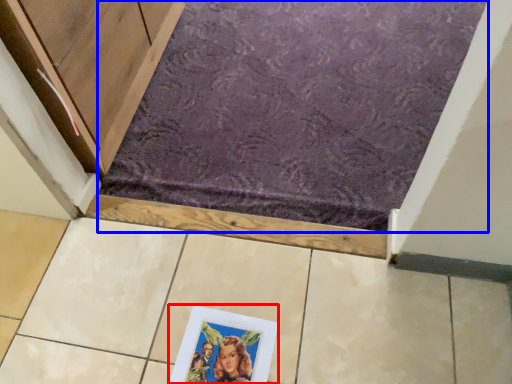
Question: Which of the following is the closest to the observer, picture frame (highlighted by a red box) or bath mat (highlighted by a blue box)?

Choices:
 (A) picture frame
 (B) bath mat

Answer: (A)